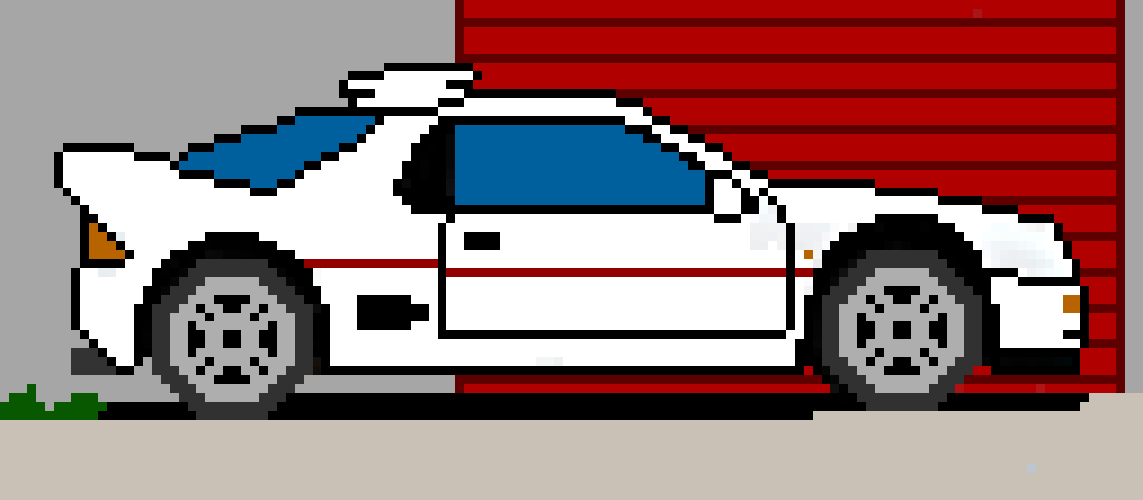
Locate an element on the screen. the right mirror is located at coordinates (727, 200).